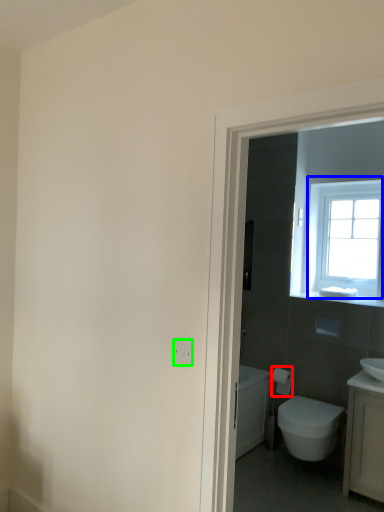
Question: Which is nearer to the toilet paper (highlighted by a red box)? window (highlighted by a blue box) or electric outlet (highlighted by a green box).

Choices:
 (A) window
 (B) electric outlet

Answer: (A)